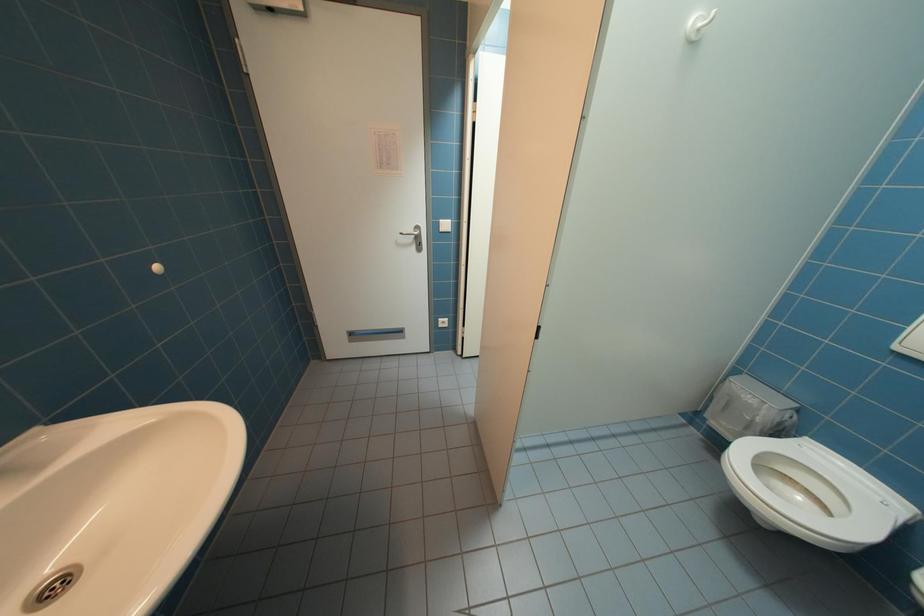
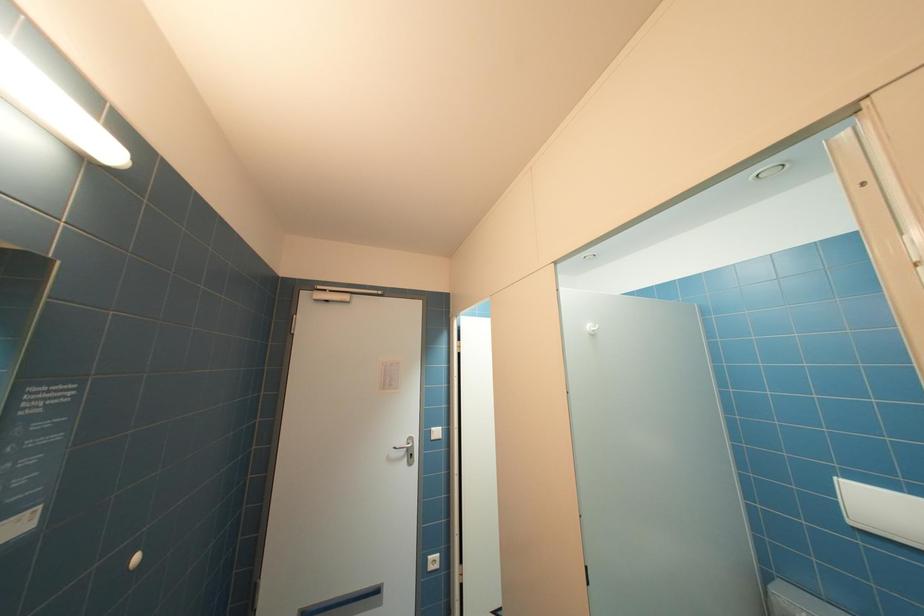
Question: The first image is from the beginning of the video and the second image is from the end. How did the camera likely rotate when shooting the video?

Choices:
 (A) Left
 (B) Right
 (C) Up
 (D) Down

Answer: (C)